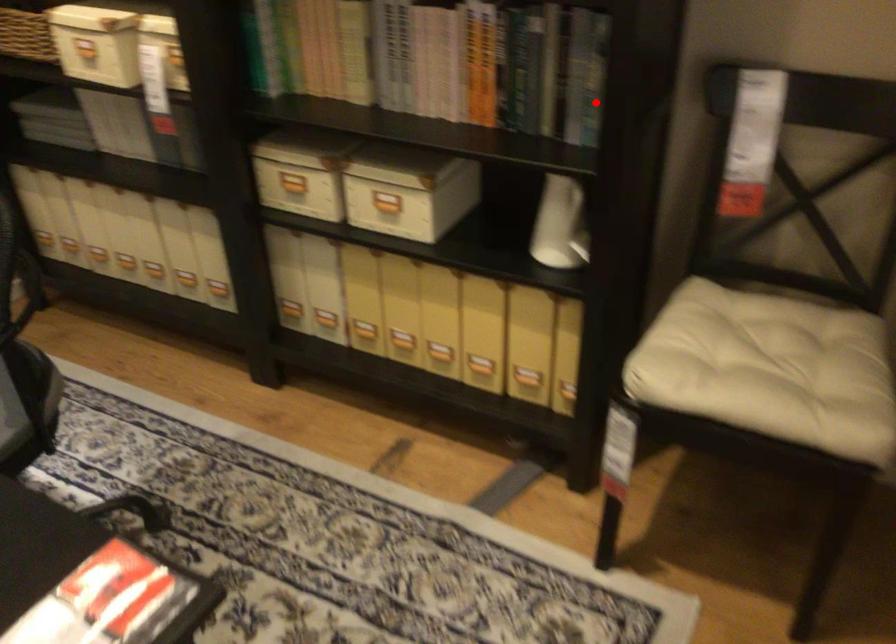
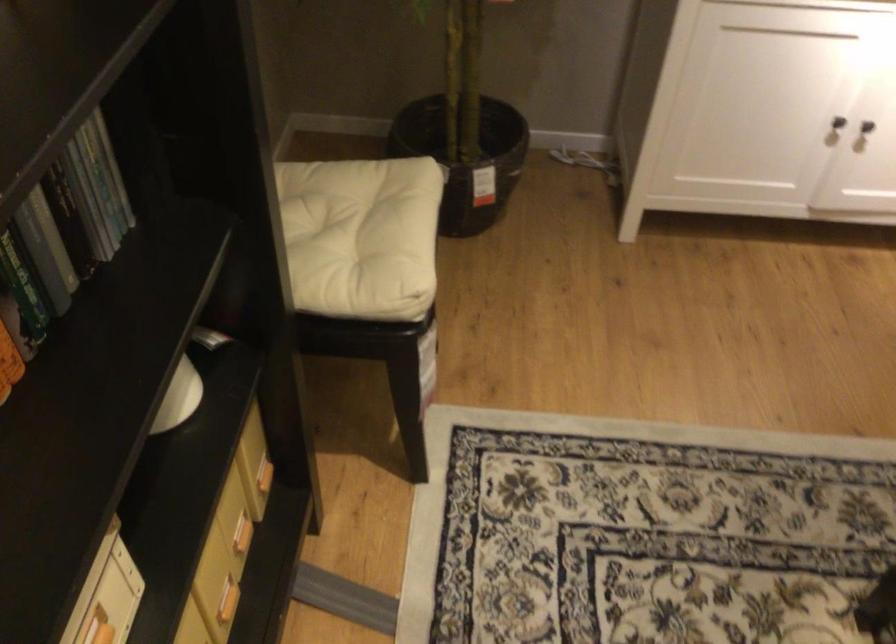
Find the pixel in the second image that matches the highlighted location in the first image.

(95, 198)